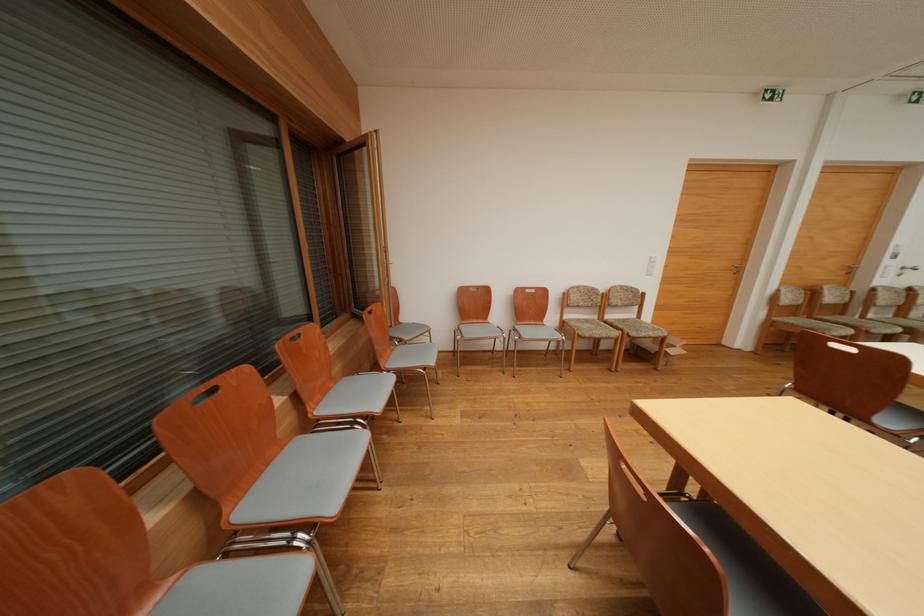
This screenshot has width=924, height=616. In order to click on patterned chair sitting surface in this screenshot , I will do `click(307, 479)`.